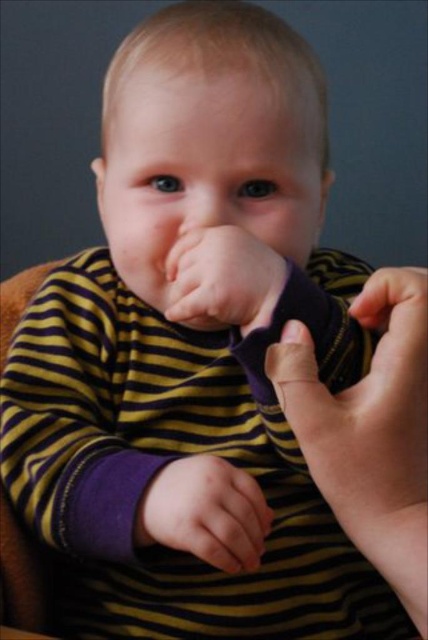
Question: Is purple fabric at lower right smaller than purple soft fabric hand at center?

Choices:
 (A) no
 (B) yes

Answer: (A)

Question: Which point is farther to the camera?

Choices:
 (A) (181, 316)
 (B) (205, 554)
 (C) (392, 419)

Answer: (A)

Question: Which object appears closest to the camera in this image?

Choices:
 (A) purple fabric at lower right
 (B) purple soft fabric hand at center
 (C) smooth skin hand at center
 (D) smooth flesh nose at center

Answer: (A)

Question: Is smooth skin hand at center further to camera compared to smooth flesh nose at center?

Choices:
 (A) no
 (B) yes

Answer: (A)

Question: Which point is farther to the camera?

Choices:
 (A) (259, 488)
 (B) (229, 296)

Answer: (A)

Question: Does smooth skin hand at center appear under smooth flesh nose at center?

Choices:
 (A) no
 (B) yes

Answer: (B)